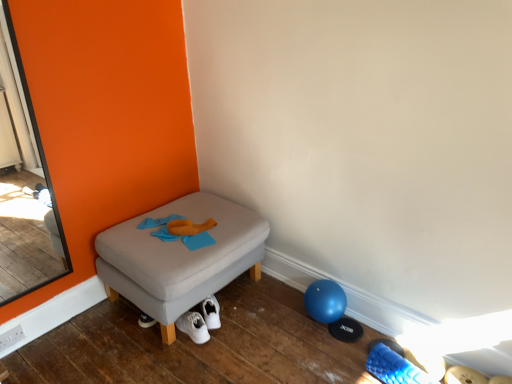
Identify the location of vacant space to the left of white fabric shoe at lower center. (343, 369).